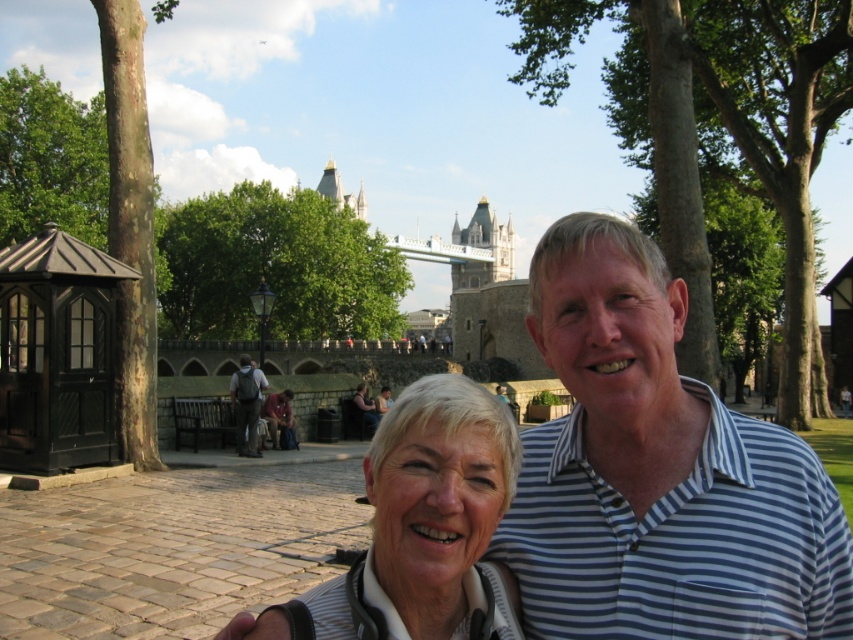
You are a photographer trying to capture the blue striped shirt at center in your shot. Based on its 2D coordinates, where should you position your camera to ensure it is centered in the frame?

The blue striped shirt at center is already at the center of the frame since its 2D coordinates are at point (x=657, y=472), which is close to the center point of the image.

You are a photographer trying to capture a photo of the blonde hair at center without including the black wood gazebo at left in the frame. Is this possible given their current positions?

The black wood gazebo at left is positioned over blonde hair at center, so it would block the view. Therefore, it is not possible to take a photo of the blonde hair at center without including the black wood gazebo at left in the frame.